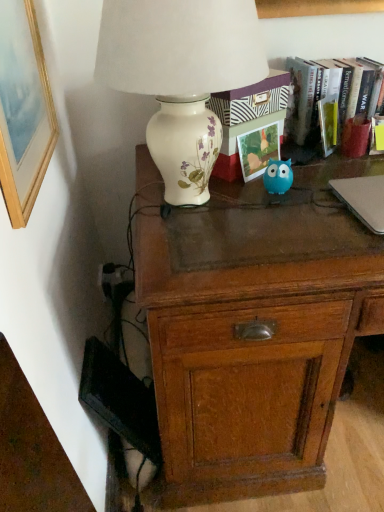
Find the location of a particular element. The image size is (384, 512). vacant space in front of blue rubber toy at center is located at coordinates (286, 217).